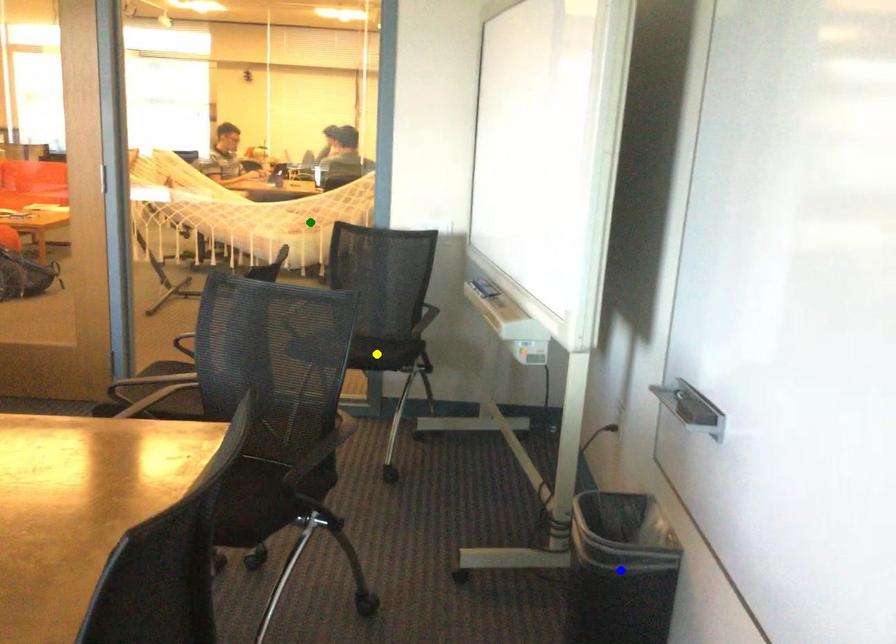
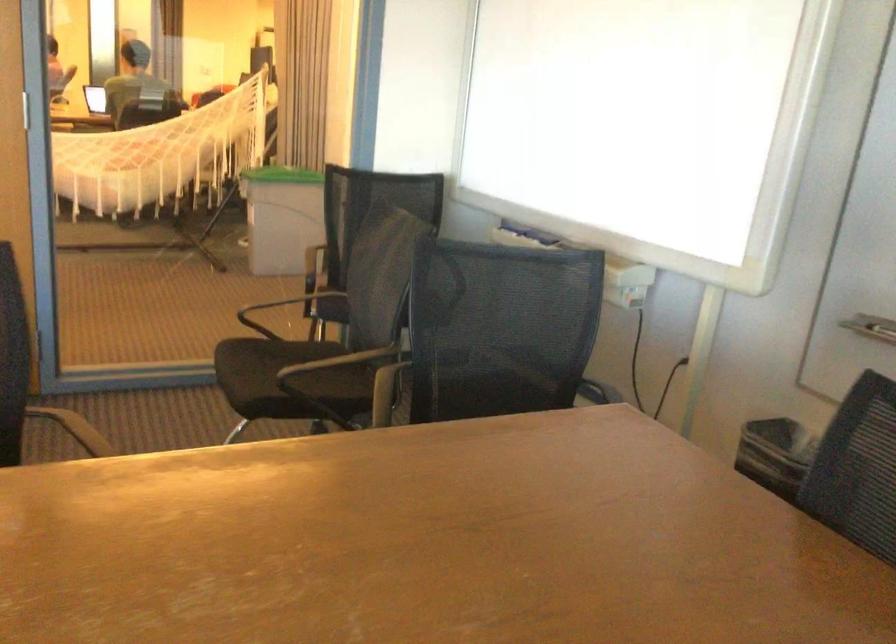
I am providing you with two images of the same scene from different viewpoints. Three points are marked in image1. Which point corresponds to a part or object that is occluded in image2?In image1, three points are marked. Which of them correspond to a part or object that is occluded in image2?Among the three points shown in image1, which one corresponds to a part or object that is no longer visible due to occlusion in image2?

yellow point, blue point